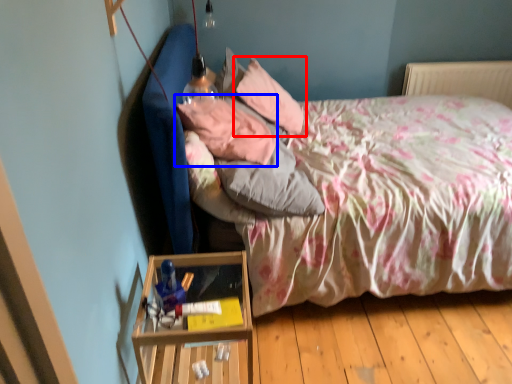
Question: Which object appears farthest to the camera in this image, pillow (highlighted by a red box) or pillow (highlighted by a blue box)?

Choices:
 (A) pillow
 (B) pillow

Answer: (A)